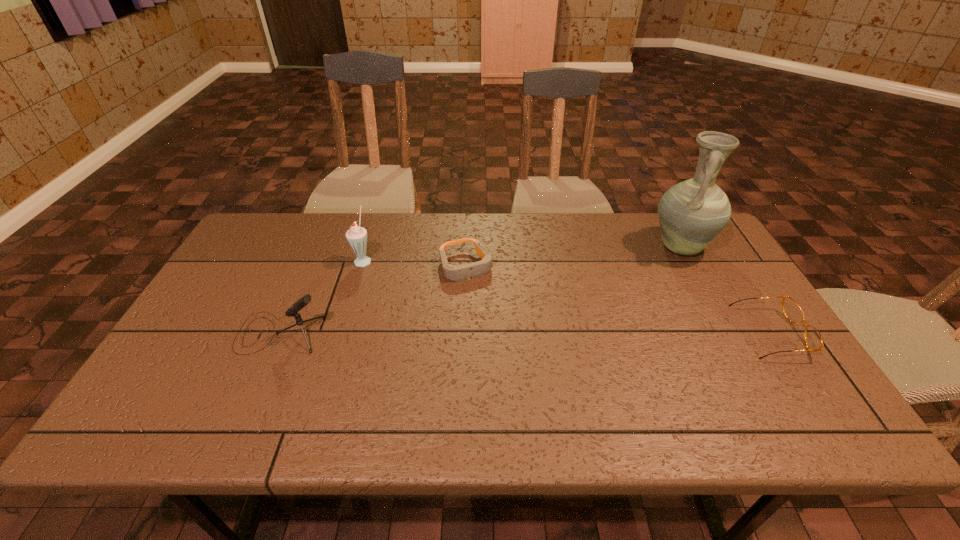
In order to click on goggles that is at the far edge in this screenshot , I will do `click(454, 273)`.

The width and height of the screenshot is (960, 540). What are the coordinates of `object that is at the left edge` in the screenshot? It's located at (301, 303).

Where is `spectacles present at the right edge`? This screenshot has width=960, height=540. spectacles present at the right edge is located at coordinates (792, 311).

At what (x,y) coordinates should I click in order to perform the action: click on pitcher situated at the right edge. Please return your answer as a coordinate pair (x, y). The width and height of the screenshot is (960, 540). Looking at the image, I should click on (691, 213).

Locate an element on the screen. This screenshot has height=540, width=960. object that is at the far right corner is located at coordinates (691, 213).

In the image, there is a desktop. Find the location of `vacant space at the far edge`. vacant space at the far edge is located at coordinates pos(304,254).

Locate an element on the screen. The width and height of the screenshot is (960, 540). vacant space at the near edge of the desktop is located at coordinates (584, 390).

In the image, there is a desktop. Where is `vacant space at the right edge`? Image resolution: width=960 pixels, height=540 pixels. vacant space at the right edge is located at coordinates (719, 281).

You are a GUI agent. You are given a task and a screenshot of the screen. Output one action in this format:
    pyautogui.click(x=<x>, y=<y>)
    Task: Click on the vacant space at the far left corner
    
    Given the screenshot: What is the action you would take?
    pyautogui.click(x=270, y=238)

Where is `free space at the far right corner of the desktop`? free space at the far right corner of the desktop is located at coordinates (724, 254).